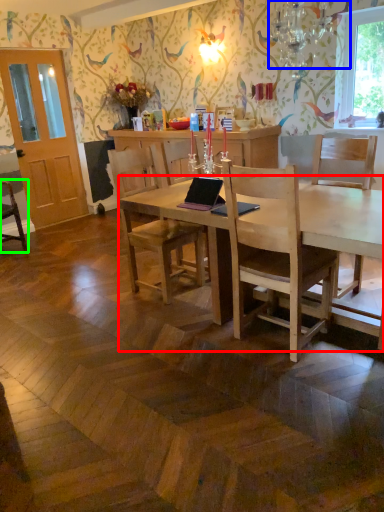
Question: Which object is positioned farthest from desk (highlighted by a red box)? Select from lamp (highlighted by a blue box) and chair (highlighted by a green box).

Choices:
 (A) lamp
 (B) chair

Answer: (B)